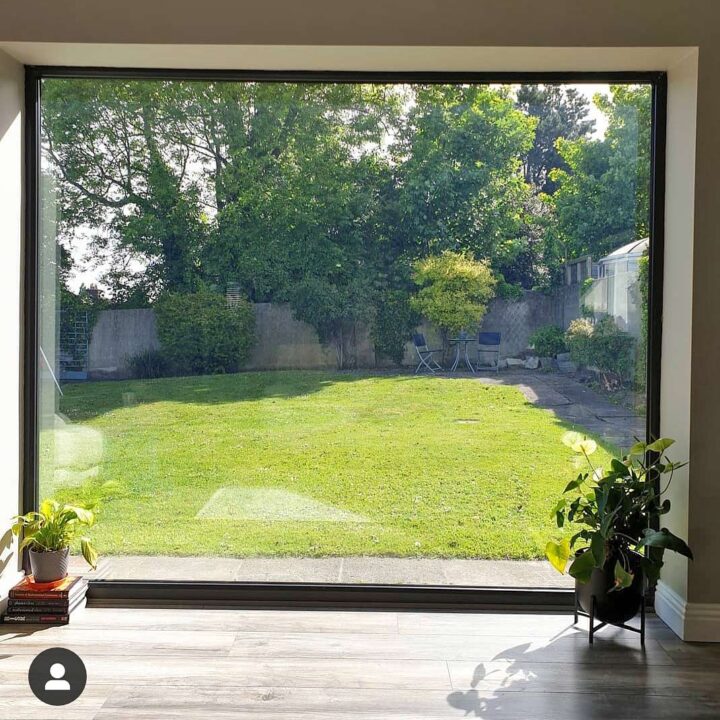
At what (x,y) coordinates should I click in order to perform the action: click on flooring. Please return your answer as a coordinate pair (x, y). This screenshot has width=720, height=720. Looking at the image, I should click on (448, 678).